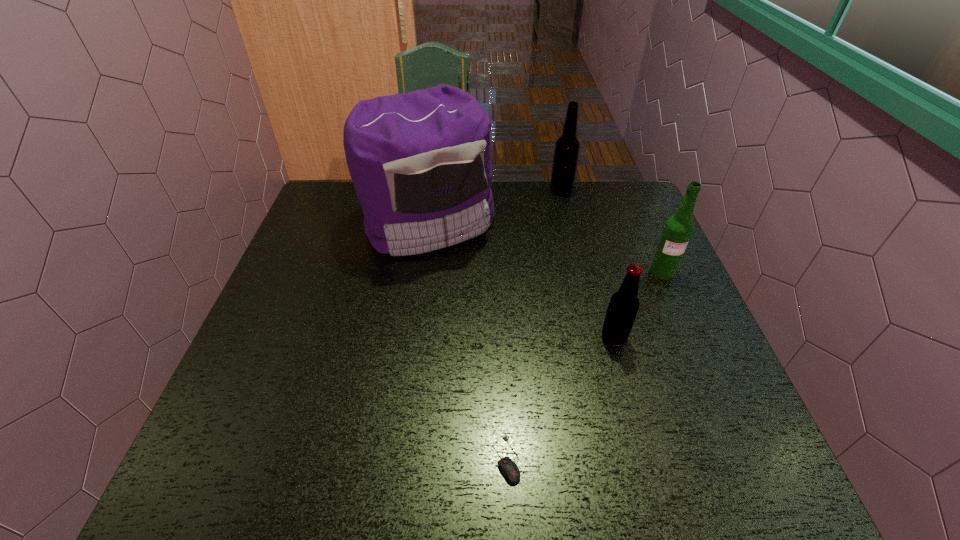
You are a GUI agent. You are given a task and a screenshot of the screen. Output one action in this format:
    pyautogui.click(x=<x>, y=<y>)
    Task: Click on the tallest object
    
    Given the screenshot: What is the action you would take?
    (420, 162)

Where is `the farthest beer bottle`? The width and height of the screenshot is (960, 540). the farthest beer bottle is located at coordinates (566, 152).

Locate an element on the screen. the rightmost object is located at coordinates (678, 229).

The width and height of the screenshot is (960, 540). What are the coordinates of `the second nearest beer bottle` in the screenshot? It's located at (678, 229).

The height and width of the screenshot is (540, 960). I want to click on the second shortest object, so click(x=624, y=304).

What are the coordinates of `the second nearest object` in the screenshot? It's located at (624, 304).

Where is `the shortest object`? the shortest object is located at coordinates (510, 470).

Where is `the nearest object`? This screenshot has width=960, height=540. the nearest object is located at coordinates (510, 470).

In order to click on vacant space located 0.190m on the front pocket of the backpack in this screenshot , I will do `click(416, 322)`.

The width and height of the screenshot is (960, 540). Find the location of `blank area located 0.130m on the left of the farthest beer bottle`. blank area located 0.130m on the left of the farthest beer bottle is located at coordinates point(510,190).